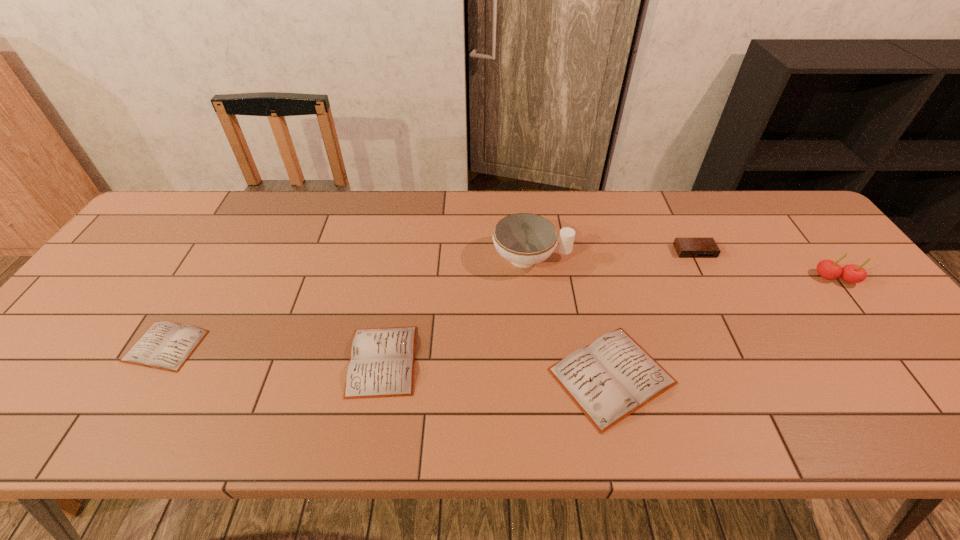
Where is `free space located on the back of the shortest object`? Image resolution: width=960 pixels, height=540 pixels. free space located on the back of the shortest object is located at coordinates (241, 220).

This screenshot has width=960, height=540. What are the coordinates of `vacant space located on the back of the second diary from right to left` in the screenshot? It's located at click(x=405, y=234).

Identify the location of free space located 0.390m on the right of the rightmost diary. [x=849, y=376].

Find the location of `vacant space located 0.140m on the side with the handle of the chinaware`. vacant space located 0.140m on the side with the handle of the chinaware is located at coordinates (619, 258).

Locate an element on the screen. The image size is (960, 540). free space located 0.310m on the back of the cherry is located at coordinates click(x=777, y=202).

Locate an element on the screen. vacant space situated 0.150m on the front face of the alarm clock is located at coordinates (718, 298).

The height and width of the screenshot is (540, 960). In order to click on object located in the far edge section of the desktop in this screenshot , I will do `click(524, 239)`.

The width and height of the screenshot is (960, 540). What are the coordinates of `object present at the right edge` in the screenshot? It's located at (828, 269).

The width and height of the screenshot is (960, 540). In order to click on vacant region at the far edge in this screenshot , I will do `click(712, 205)`.

This screenshot has height=540, width=960. In order to click on free space at the near edge of the desktop in this screenshot , I will do `click(870, 395)`.